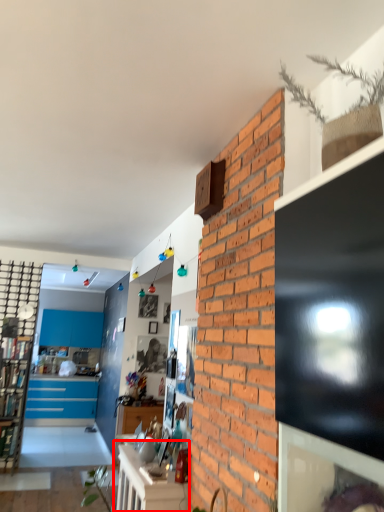
Question: From the image's perspective, where is table (annotated by the red box) located relative to cabinetry?

Choices:
 (A) below
 (B) above

Answer: (A)